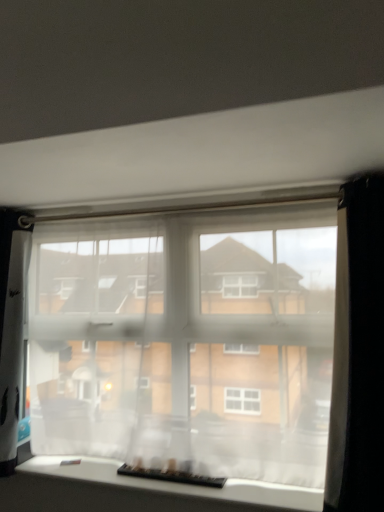
Question: Based on their positions, is translucent fabric at center, which appears as the 1th window when viewed from the top, located to the left or right of black plastic keyboard at lower center?

Choices:
 (A) left
 (B) right

Answer: (B)

Question: From the image's perspective, relative to black plastic keyboard at lower center, is translucent fabric at center, which appears as the 2th window when ordered from the bottom, above or below?

Choices:
 (A) below
 (B) above

Answer: (B)

Question: Which object is positioned farthest from the translucent fabric at bottom, marked as the 2th window in a top-to-bottom arrangement?

Choices:
 (A) black plastic keyboard at lower center
 (B) black sheer curtain at right
 (C) translucent fabric at center, which appears as the 1th window when viewed from the top

Answer: (B)

Question: Which of these objects is positioned closest to the translucent fabric at bottom, which is counted as the 1th window, starting from the bottom?

Choices:
 (A) black plastic keyboard at lower center
 (B) black sheer curtain at right
 (C) translucent fabric at center, which appears as the 1th window when viewed from the top

Answer: (A)